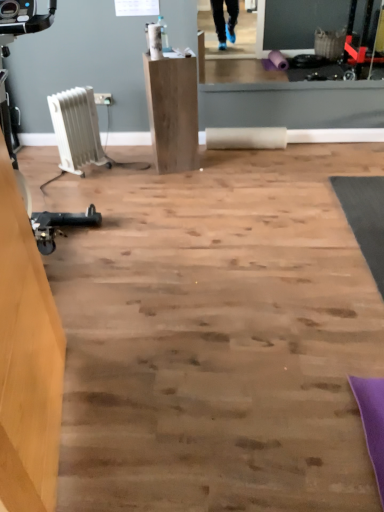
The width and height of the screenshot is (384, 512). I want to click on vacant point above natural wood pedestal at center, the 1th furniture viewed from the back (from a real-world perspective), so point(170,53).